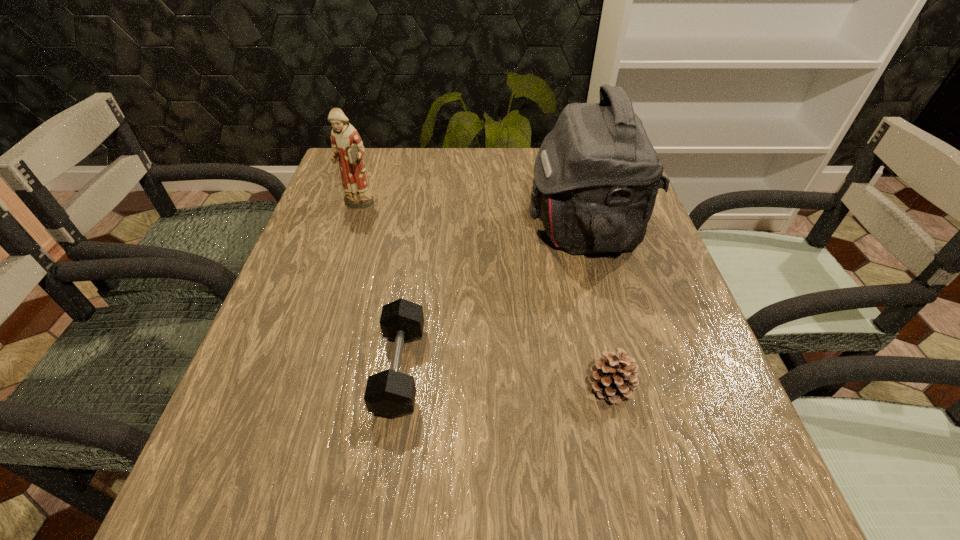
This screenshot has width=960, height=540. In order to click on free region at the far left corner of the desktop in this screenshot , I will do `click(372, 177)`.

Where is `vacant region at the near right corner`? This screenshot has width=960, height=540. vacant region at the near right corner is located at coordinates (754, 502).

I want to click on free space between the second object from left to right and the tallest object, so click(492, 299).

Locate an element on the screen. free area in between the pinecone and the dumbbell is located at coordinates (505, 379).

Identify the location of free area in between the leftmost object and the pinecone. (484, 296).

At what (x,y) coordinates should I click in order to perform the action: click on vacant point located between the tallest object and the pinecone. Please return your answer as a coordinate pair (x, y). Looking at the image, I should click on (596, 308).

Find the location of a particular element. free space that is in between the dumbbell and the pinecone is located at coordinates (505, 379).

The width and height of the screenshot is (960, 540). I want to click on free space between the third shortest object and the dumbbell, so click(379, 287).

I want to click on free space between the second object from left to right and the figurine, so click(379, 287).

The image size is (960, 540). Identify the location of free area in between the pinecone and the second object from left to right. (505, 379).